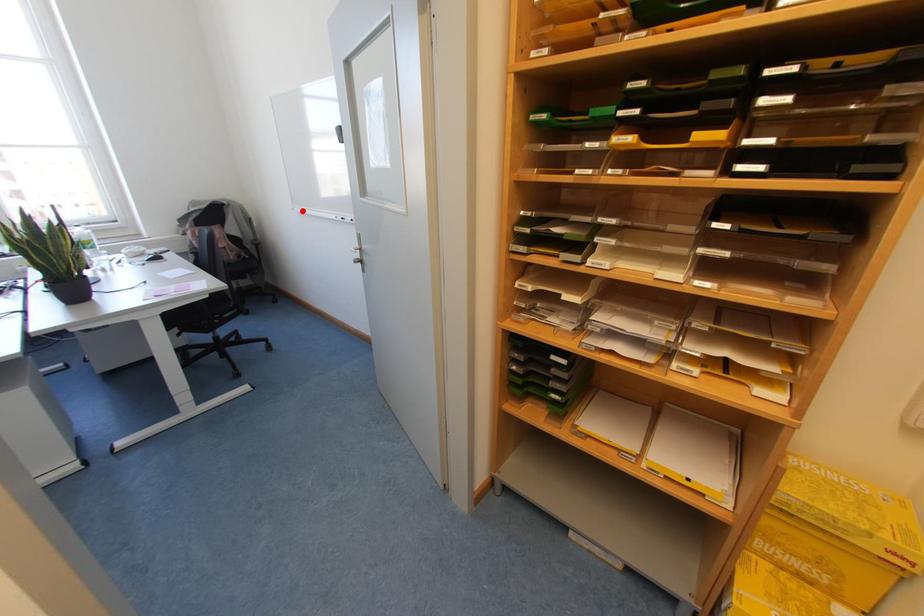
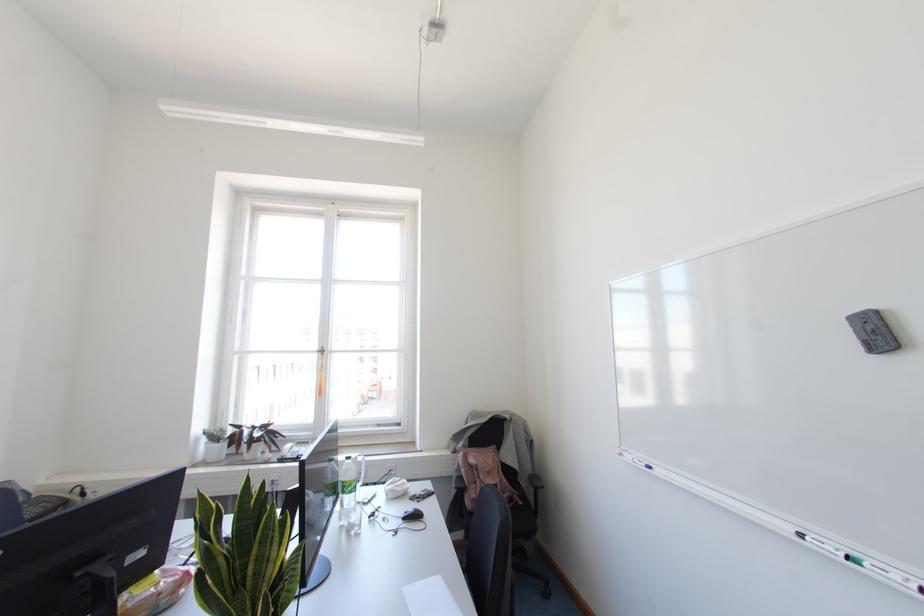
In the second image, find the point that corresponds to the highlighted location in the first image.

(649, 467)